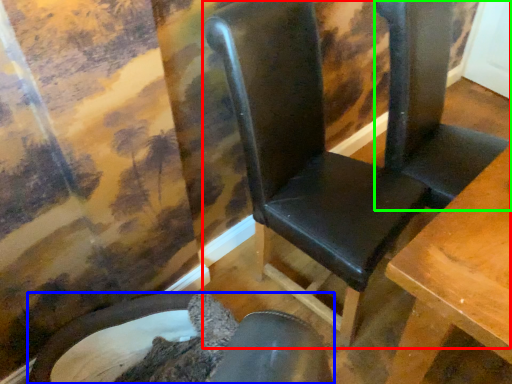
Question: Estimate the real-world distances between objects in this image. Which object is closer to chair (highlighted by a red box), chair (highlighted by a blue box) or folding chair (highlighted by a green box)?

Choices:
 (A) chair
 (B) folding chair

Answer: (B)